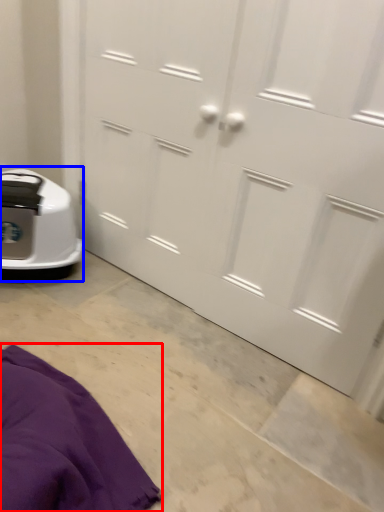
Question: Which point is further to the camera, blanket (highlighted by a red box) or home appliance (highlighted by a blue box)?

Choices:
 (A) blanket
 (B) home appliance

Answer: (B)